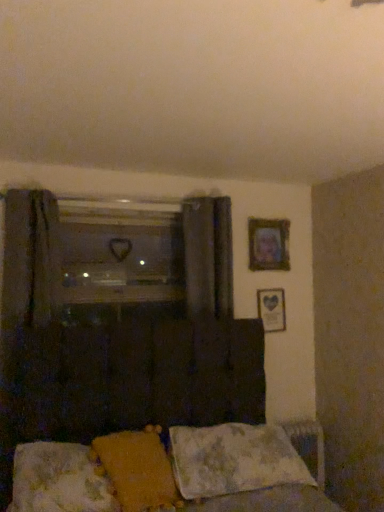
Question: Is fluffy fabric bed at lower center taller or shorter than wooden picture frame at upper right, which is counted as the second picture frame, starting from the bottom?

Choices:
 (A) tall
 (B) short

Answer: (A)

Question: Looking at the image, does fluffy fabric bed at lower center seem bigger or smaller compared to wooden picture frame at upper right, which is counted as the second picture frame, starting from the bottom?

Choices:
 (A) small
 (B) big

Answer: (B)

Question: Which object is the farthest from the wooden picture frame at upper right, which is counted as the second picture frame, starting from the bottom?

Choices:
 (A) fluffy fabric bed at lower center
 (B) fluffy white pillow at lower center, the 3th pillow when ordered from left to right
 (C) yellow fabric pillow at lower center, placed as the second pillow when sorted from left to right
 (D) fluffy white pillow at lower center, which ranks as the 1th pillow in left-to-right order
 (E) transparent glass window at center

Answer: (D)

Question: Considering the real-world distances, which object is farthest from the fluffy white pillow at lower center, which ranks as the 3th pillow in right-to-left order?

Choices:
 (A) fluffy white pillow at lower center, the 3th pillow when ordered from left to right
 (B) dark gray fabric curtain at center
 (C) wooden picture frame at upper right, which is counted as the second picture frame, starting from the bottom
 (D) wooden framed picture at upper right, which ranks as the 2th picture frame in top-to-bottom order
 (E) yellow fabric pillow at lower center, placed as the second pillow when sorted from left to right

Answer: (C)